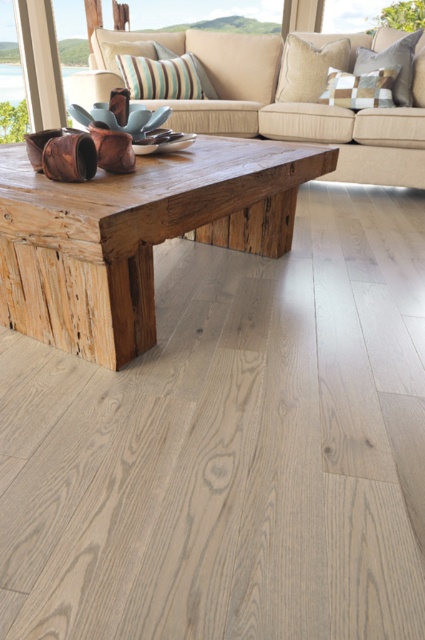
Consider the image. Which is more to the left, weathered wood coffee table at center or beige fabric couch at center?

weathered wood coffee table at center is more to the left.

Who is lower down, weathered wood coffee table at center or beige fabric couch at center?

weathered wood coffee table at center is below.

Who is more forward, (231, 241) or (384, 122)?

Point (231, 241)

Where is `weathered wood coffee table at center`? This screenshot has height=640, width=425. weathered wood coffee table at center is located at coordinates (135, 234).